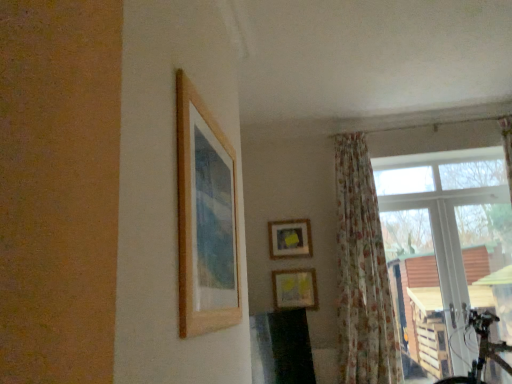
Question: Is matte yellow picture frame at center, which is counted as the 2th picture frame, starting from the bottom, inside the boundaries of transparent glass window at right, or outside?

Choices:
 (A) outside
 (B) inside

Answer: (A)

Question: Does point pos(286,238) appear closer or farther from the camera than point pos(467,339)?

Choices:
 (A) farther
 (B) closer

Answer: (A)

Question: Which object is the closest to the wooden picture frame at upper left, placed as the first picture frame when sorted from top to bottom?

Choices:
 (A) floral fabric curtain at right
 (B) transparent glass window at right
 (C) matte wooden picture frame at center, which is counted as the third picture frame, starting from the top
 (D) matte yellow picture frame at center, which is counted as the first picture frame, starting from the back

Answer: (A)

Question: Based on their relative distances, which object is farther from the matte wooden picture frame at center, which is counted as the 2th picture frame, starting from the back?

Choices:
 (A) transparent glass window at right
 (B) matte yellow picture frame at center, which is counted as the first picture frame, starting from the back
 (C) floral fabric curtain at right
 (D) wooden picture frame at upper left, positioned as the 3th picture frame in bottom-to-top order

Answer: (D)